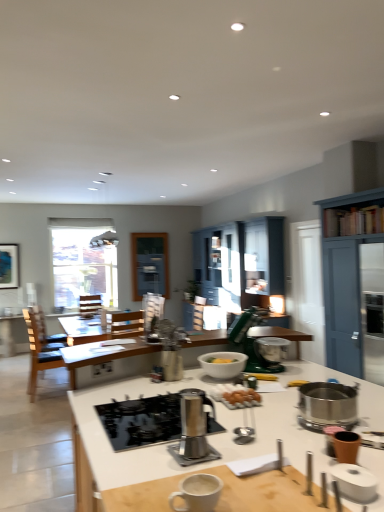
The width and height of the screenshot is (384, 512). In order to click on free spot to the left of matte plastic armchair at center, which appears as the 2th armchair when viewed from the left in this screenshot , I will do `click(130, 346)`.